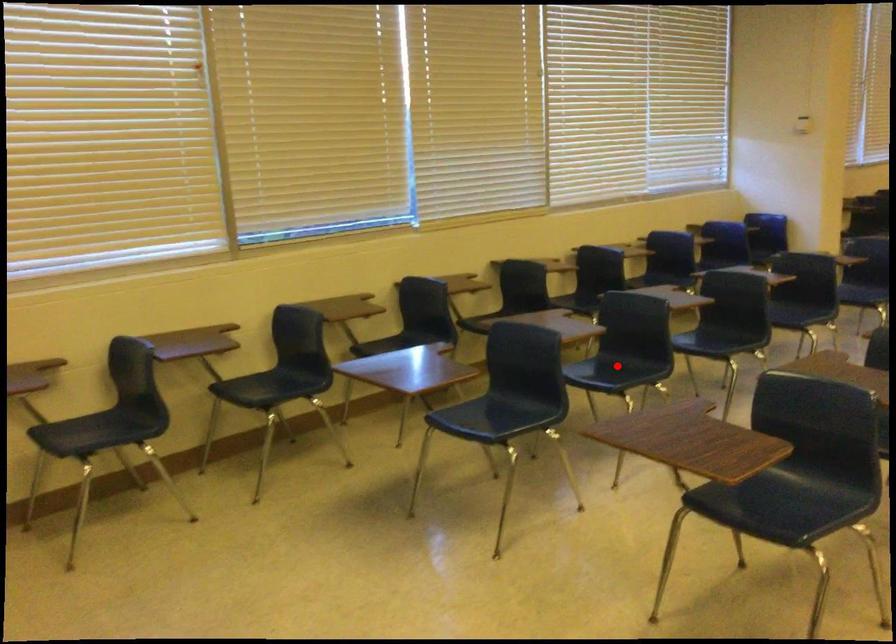
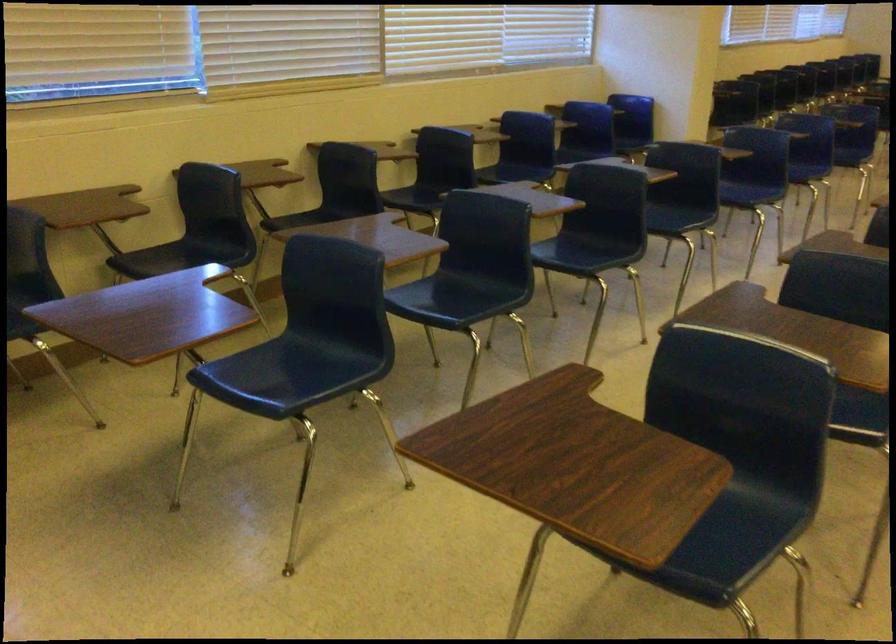
Question: I am providing you with two images of the same scene from different viewpoints. In image1, a red point is highlighted. Considering the same 3D point in image2, which of the following is correct?

Choices:
 (A) It is closer
 (B) It is farther

Answer: (A)